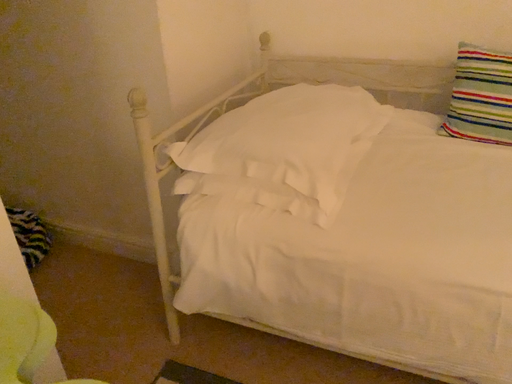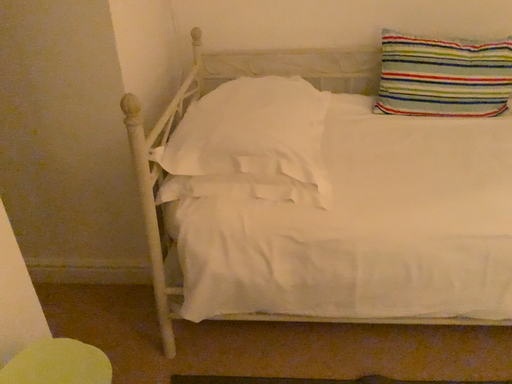
Question: Which way did the camera rotate in the video?

Choices:
 (A) rotated right
 (B) rotated left

Answer: (A)